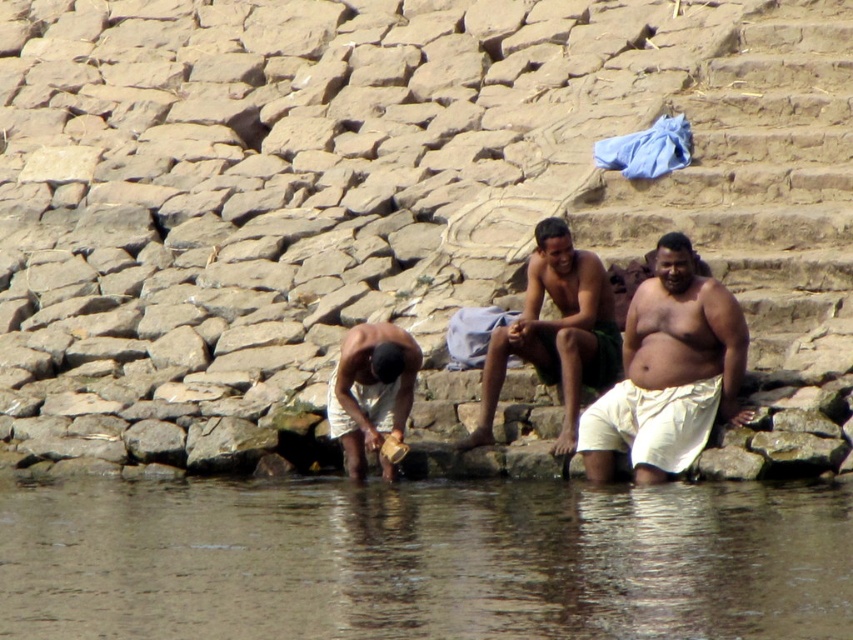
Question: Can you confirm if smooth rock at lower left is bigger than white cotton cloth at center?

Choices:
 (A) no
 (B) yes

Answer: (B)

Question: Is white cotton cloth at center bigger than white cloth at lower left?

Choices:
 (A) yes
 (B) no

Answer: (A)

Question: Which point is farther from the camera taking this photo?

Choices:
 (A) (761, 113)
 (B) (531, 352)
 (C) (688, 608)

Answer: (A)

Question: Among these objects, which one is farthest from the camera?

Choices:
 (A) white cloth at lower left
 (B) smooth rock at lower left

Answer: (A)

Question: Estimate the real-world distances between objects in this image. Which object is farther from the brown water at lower center?

Choices:
 (A) white cloth at lower left
 (B) smooth rock at lower left
 (C) white cotton cloth at center

Answer: (B)

Question: Does white cotton cloth at center have a larger size compared to white cloth at lower left?

Choices:
 (A) no
 (B) yes

Answer: (B)